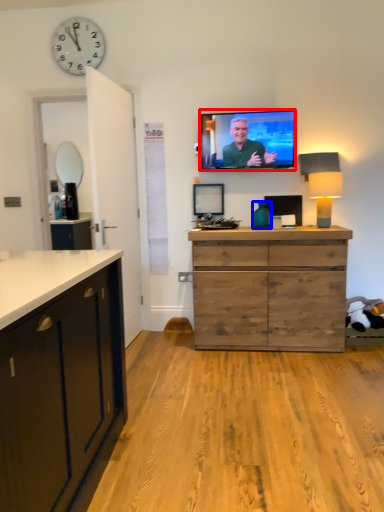
Question: Among these objects, which one is nearest to the camera, television (highlighted by a red box) or vase (highlighted by a blue box)?

Choices:
 (A) television
 (B) vase

Answer: (B)